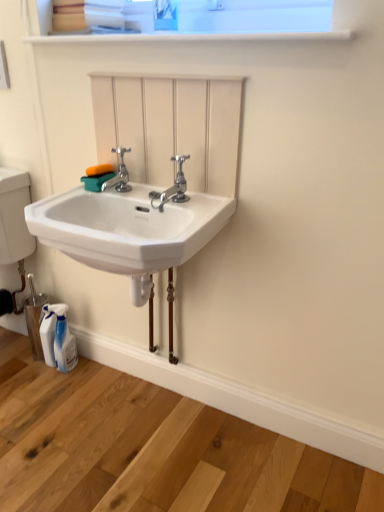
In order to face white ceramic sink at center, should I rotate leftwards or rightwards?

A 8.974 degree turn to the left will do.

The image size is (384, 512). What do you see at coordinates (173, 187) in the screenshot? I see `polished chrome faucet at center, the 2th tap from the left` at bounding box center [173, 187].

Image resolution: width=384 pixels, height=512 pixels. I want to click on white glossy shelf at upper center, so click(x=179, y=36).

Is the position of white glossy shelf at upper center less distant than that of polished chrome faucet at center, which is the first tap from right to left?

That is True.

Can you confirm if white glossy shelf at upper center is thinner than polished chrome faucet at center, which is the first tap from right to left?

No, white glossy shelf at upper center is not thinner than polished chrome faucet at center, which is the first tap from right to left.

Between white glossy shelf at upper center and polished chrome faucet at center, which is the first tap from right to left, which one appears on the right side from the viewer's perspective?

From the viewer's perspective, white glossy shelf at upper center appears more on the right side.

Can you tell me how much white glossy shelf at upper center and polished chrome faucet at center, which is the first tap from right to left, differ in facing direction?

white glossy shelf at upper center and polished chrome faucet at center, which is the first tap from right to left, are facing 1.72 degrees away from each other.

Looking at this image, between chrome metallic faucet at center, which is the second tap from right to left, and white glossy spray bottle at lower left, which one has larger size?

Bigger between the two is white glossy spray bottle at lower left.

Which is more to the right, chrome metallic faucet at center, which is the second tap from right to left, or white glossy spray bottle at lower left?

chrome metallic faucet at center, which is the second tap from right to left.

In the scene shown: From the image's perspective, between chrome metallic faucet at center, acting as the first tap starting from the left, and white glossy spray bottle at lower left, who is located below?

From the image's view, white glossy spray bottle at lower left is below.

From a real-world perspective, is chrome metallic faucet at center, acting as the first tap starting from the left, over white glossy shelf at upper center?

No, from a real-world perspective, chrome metallic faucet at center, acting as the first tap starting from the left, is not over white glossy shelf at upper center

Is chrome metallic faucet at center, acting as the first tap starting from the left, completely or partially outside of white glossy shelf at upper center?

Yes, chrome metallic faucet at center, acting as the first tap starting from the left, is outside of white glossy shelf at upper center.

From a real-world perspective, which tap is the 1st one underneath the white glossy shelf at upper center? Please provide its 2D coordinates.

[(119, 173)]

Which object is positioned more to the left, chrome metallic faucet at center, which is the second tap from right to left, or white glossy shelf at upper center?

chrome metallic faucet at center, which is the second tap from right to left.

Is polished chrome faucet at center, the 2th tap from the left, facing towards white ceramic sink at center?

No, polished chrome faucet at center, the 2th tap from the left, is not turned towards white ceramic sink at center.

Is polished chrome faucet at center, which is the first tap from right to left, completely or partially outside of white ceramic sink at center?

polished chrome faucet at center, which is the first tap from right to left, lies outside white ceramic sink at center's area.

From a real-world perspective, which is physically below, polished chrome faucet at center, the 2th tap from the left, or white ceramic sink at center?

white ceramic sink at center.

Is polished chrome faucet at center, which is the first tap from right to left, at the left side of white ceramic sink at center?

In fact, polished chrome faucet at center, which is the first tap from right to left, is to the right of white ceramic sink at center.

Considering the relative sizes of white glossy spray bottle at lower left and white glossy shelf at upper center in the image provided, is white glossy spray bottle at lower left bigger than white glossy shelf at upper center?

Actually, white glossy spray bottle at lower left might be smaller than white glossy shelf at upper center.

From the image's perspective, is white glossy spray bottle at lower left on top of white glossy shelf at upper center?

Incorrect, from the image's perspective, white glossy spray bottle at lower left is lower than white glossy shelf at upper center.

From a real-world perspective, is white glossy spray bottle at lower left positioned above or below white glossy shelf at upper center?

From a real-world perspective, white glossy spray bottle at lower left is physically below white glossy shelf at upper center.

Considering the relative positions of white glossy spray bottle at lower left and white glossy shelf at upper center in the image provided, is white glossy spray bottle at lower left to the left or to the right of white glossy shelf at upper center?

From the image, it's evident that white glossy spray bottle at lower left is to the left of white glossy shelf at upper center.

Does white ceramic sink at center have a smaller size compared to chrome metallic faucet at center, acting as the first tap starting from the left?

Incorrect, white ceramic sink at center is not smaller in size than chrome metallic faucet at center, acting as the first tap starting from the left.

Is white ceramic sink at center taller or shorter than chrome metallic faucet at center, which is the second tap from right to left?

white ceramic sink at center is taller than chrome metallic faucet at center, which is the second tap from right to left.

Are white ceramic sink at center and chrome metallic faucet at center, which is the second tap from right to left, located far from each other?

white ceramic sink at center is actually quite close to chrome metallic faucet at center, which is the second tap from right to left.

At what (x,y) coordinates should I click in order to perform the action: click on sink that is below the chrome metallic faucet at center, which is the second tap from right to left (from the image's perspective). Please return your answer as a coordinate pair (x, y). This screenshot has width=384, height=512. Looking at the image, I should click on tap(129, 230).

Is white ceramic sink at center in contact with white glossy spray bottle at lower left?

No, white ceramic sink at center is not touching white glossy spray bottle at lower left.

Can you confirm if white ceramic sink at center is shorter than white glossy spray bottle at lower left?

Yes.

From a real-world perspective, between white ceramic sink at center and white glossy spray bottle at lower left, who is vertically lower?

white glossy spray bottle at lower left.

Considering the relative sizes of white ceramic sink at center and white glossy spray bottle at lower left in the image provided, is white ceramic sink at center bigger than white glossy spray bottle at lower left?

Yes.

Find the location of a particular element. This screenshot has width=384, height=512. the 1st tap behind the white glossy shelf at upper center is located at coordinates pos(173,187).

What are the coordinates of `toiletry that appears below the chrome metallic faucet at center, which is the second tap from right to left (from the image's perspective)` in the screenshot? It's located at (63, 340).

Considering their positions, is white glossy shelf at upper center positioned closer to white glossy spray bottle at lower left than polished chrome faucet at center, which is the first tap from right to left?

Among the two, polished chrome faucet at center, which is the first tap from right to left, is located nearer to white glossy spray bottle at lower left.

Which object lies further to the anchor point polished chrome faucet at center, which is the first tap from right to left, white glossy spray bottle at lower left or white glossy shelf at upper center?

Among the two, white glossy spray bottle at lower left is located further to polished chrome faucet at center, which is the first tap from right to left.

Considering their positions, is chrome metallic faucet at center, acting as the first tap starting from the left, positioned closer to polished chrome faucet at center, the 2th tap from the left, than white glossy spray bottle at lower left?

chrome metallic faucet at center, acting as the first tap starting from the left, is closer to polished chrome faucet at center, the 2th tap from the left.

From the image, which object appears to be farther from chrome metallic faucet at center, which is the second tap from right to left, white ceramic sink at center or white glossy shelf at upper center?

white glossy shelf at upper center lies further to chrome metallic faucet at center, which is the second tap from right to left, than the other object.

Looking at the image, which one is located further to polished chrome faucet at center, the 2th tap from the left, chrome metallic faucet at center, which is the second tap from right to left, or white glossy shelf at upper center?

white glossy shelf at upper center lies further to polished chrome faucet at center, the 2th tap from the left, than the other object.

Based on the photo, looking at the image, which one is located closer to white glossy shelf at upper center, white ceramic sink at center or polished chrome faucet at center, the 2th tap from the left?

Among the two, polished chrome faucet at center, the 2th tap from the left, is located nearer to white glossy shelf at upper center.

From the image, which object appears to be nearer to white ceramic sink at center, polished chrome faucet at center, which is the first tap from right to left, or white glossy spray bottle at lower left?

polished chrome faucet at center, which is the first tap from right to left.

Which object lies nearer to the anchor point white glossy shelf at upper center, polished chrome faucet at center, which is the first tap from right to left, or chrome metallic faucet at center, which is the second tap from right to left?

chrome metallic faucet at center, which is the second tap from right to left, is closer to white glossy shelf at upper center.

Find the location of a particular element. This screenshot has height=512, width=384. tap between chrome metallic faucet at center, which is the second tap from right to left, and white glossy spray bottle at lower left, in the vertical direction is located at coordinates (173, 187).

This screenshot has height=512, width=384. In order to click on sink between white glossy shelf at upper center and white glossy spray bottle at lower left vertically in this screenshot , I will do `click(129, 230)`.

Locate an element on the screen. Image resolution: width=384 pixels, height=512 pixels. tap between white glossy shelf at upper center and polished chrome faucet at center, the 2th tap from the left, in the up-down direction is located at coordinates (119, 173).

The height and width of the screenshot is (512, 384). Find the location of `tap positioned between white ceramic sink at center and chrome metallic faucet at center, which is the second tap from right to left, from near to far`. tap positioned between white ceramic sink at center and chrome metallic faucet at center, which is the second tap from right to left, from near to far is located at coordinates 173,187.